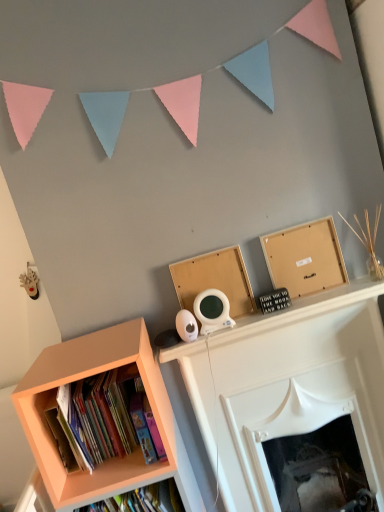
Question: Does matte orange bookshelf at lower left appear on the right side of matte orange bookcase at lower left?

Choices:
 (A) no
 (B) yes

Answer: (A)

Question: Is matte orange bookshelf at lower left closer to camera compared to matte orange bookcase at lower left?

Choices:
 (A) yes
 (B) no

Answer: (B)

Question: Is matte orange bookcase at lower left a part of matte orange bookshelf at lower left?

Choices:
 (A) yes
 (B) no

Answer: (B)

Question: From a real-world perspective, is matte orange bookshelf at lower left located higher than matte orange bookcase at lower left?

Choices:
 (A) yes
 (B) no

Answer: (A)

Question: Considering the relative sizes of matte orange bookshelf at lower left and matte orange bookcase at lower left in the image provided, is matte orange bookshelf at lower left shorter than matte orange bookcase at lower left?

Choices:
 (A) yes
 (B) no

Answer: (A)

Question: Considering the positions of matte orange bookshelf at lower left and wooden frame at upper right in the image, is matte orange bookshelf at lower left bigger or smaller than wooden frame at upper right?

Choices:
 (A) small
 (B) big

Answer: (B)

Question: Choose the correct answer: Is matte orange bookshelf at lower left inside wooden frame at upper right or outside it?

Choices:
 (A) outside
 (B) inside

Answer: (A)

Question: Is point (114, 448) closer or farther from the camera than point (294, 267)?

Choices:
 (A) closer
 (B) farther

Answer: (A)

Question: Is matte orange bookshelf at lower left in front of or behind wooden frame at upper right in the image?

Choices:
 (A) behind
 (B) front

Answer: (B)

Question: In the image, is white glossy fireplace at upper center on the left side or the right side of bare wood board at upper center?

Choices:
 (A) right
 (B) left

Answer: (A)

Question: Is white glossy fireplace at upper center in front of or behind bare wood board at upper center in the image?

Choices:
 (A) front
 (B) behind

Answer: (A)

Question: Is white glossy fireplace at upper center inside or outside of bare wood board at upper center?

Choices:
 (A) outside
 (B) inside

Answer: (A)

Question: In terms of size, does white glossy fireplace at upper center appear bigger or smaller than bare wood board at upper center?

Choices:
 (A) small
 (B) big

Answer: (B)

Question: Considering the positions of point (248, 309) and point (362, 409), is point (248, 309) closer or farther from the camera than point (362, 409)?

Choices:
 (A) farther
 (B) closer

Answer: (B)

Question: Which is correct: bare wood board at upper center is inside white glossy fireplace at upper center, or outside of it?

Choices:
 (A) inside
 (B) outside

Answer: (B)